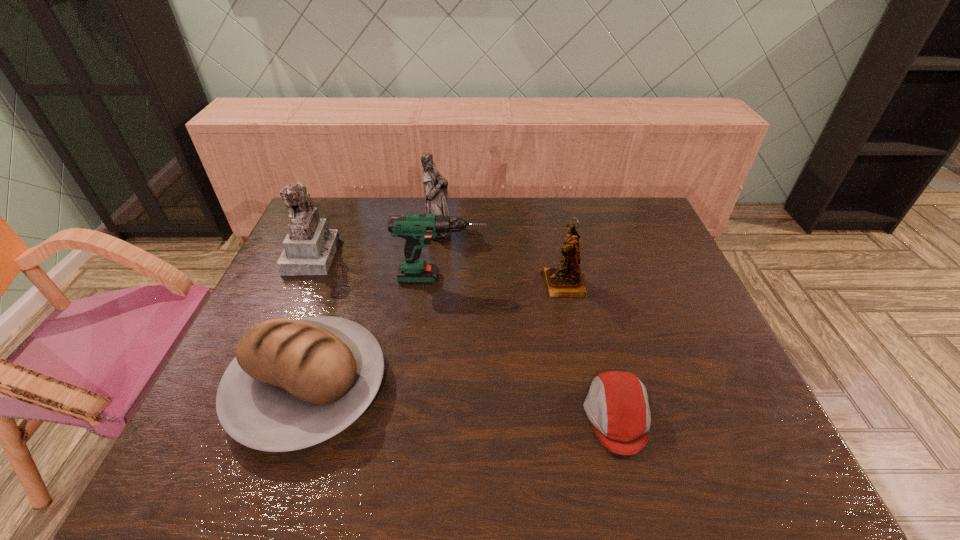
What are the coordinates of `the second figurine from right to left` in the screenshot? It's located at (435, 185).

I want to click on the leftmost figurine, so click(309, 247).

You are a GUI agent. You are given a task and a screenshot of the screen. Output one action in this format:
    pyautogui.click(x=<x>, y=<y>)
    Task: Click on the drill
    Image resolution: width=960 pixels, height=540 pixels.
    Given the screenshot: What is the action you would take?
    pyautogui.click(x=417, y=229)

Identify the location of the shortest figurine. (566, 280).

Locate an element on the screen. Image resolution: width=960 pixels, height=540 pixels. the fifth tallest object is located at coordinates (293, 384).

Locate an element on the screen. The width and height of the screenshot is (960, 540). the shortest object is located at coordinates (617, 405).

Find the location of `free space located on the front-facing side of the second figurine from left to right`. free space located on the front-facing side of the second figurine from left to right is located at coordinates (469, 228).

Find the location of a particular element. vacant position located 0.050m on the front-facing side of the leftmost figurine is located at coordinates (351, 255).

Where is `vacant space located 0.330m on the handle side of the drill`? The width and height of the screenshot is (960, 540). vacant space located 0.330m on the handle side of the drill is located at coordinates (598, 279).

I want to click on vacant position located 0.060m on the front-facing side of the shortest figurine, so click(522, 285).